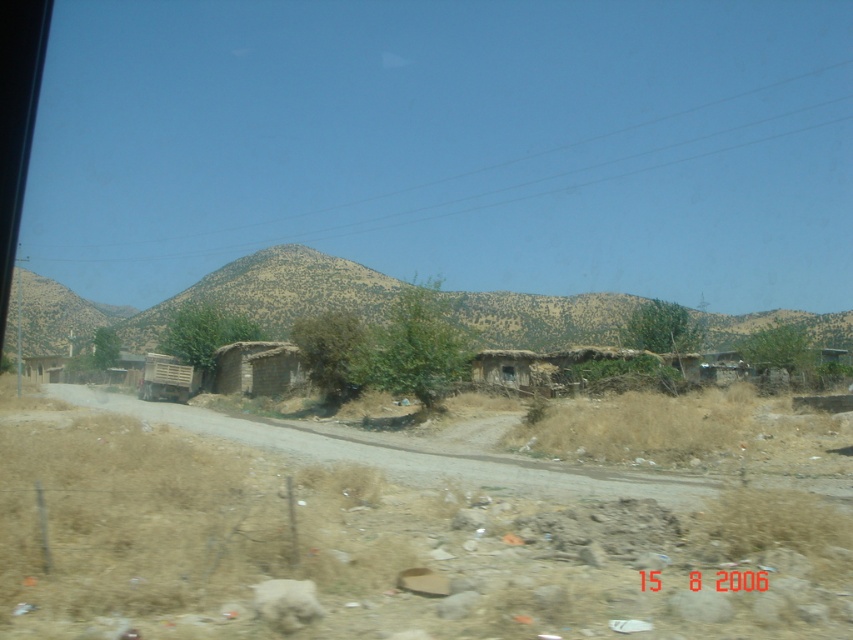
Is brown textured mountain at center positioned behind brown mud hut at center?

No, it is not.

Can you confirm if brown textured mountain at center is positioned above brown mud hut at center?

Correct, brown textured mountain at center is located above brown mud hut at center.

The image size is (853, 640). Find the location of `brown textured mountain at center`. brown textured mountain at center is located at coordinates (212, 300).

Between brown textured mountain at center and brown dirt track at center, which one is positioned higher?

brown textured mountain at center is above.

At what (x,y) coordinates should I click in order to perform the action: click on brown textured mountain at center. Please return your answer as a coordinate pair (x, y). The width and height of the screenshot is (853, 640). Looking at the image, I should click on (212, 300).

Is point (834, 340) more distant than point (488, 456)?

Yes, point (834, 340) is behind point (488, 456).

Where is `brown textured mountain at center`? The height and width of the screenshot is (640, 853). brown textured mountain at center is located at coordinates (212, 300).

Can you confirm if brown dirt track at center is bigger than brown mud hut at center?

Yes, brown dirt track at center is bigger than brown mud hut at center.

Does brown dirt track at center appear on the left side of brown mud hut at center?

In fact, brown dirt track at center is to the right of brown mud hut at center.

Which is in front, point (548, 496) or point (260, 340)?

Point (548, 496)

Image resolution: width=853 pixels, height=640 pixels. Identify the location of brown dirt track at center. (410, 451).